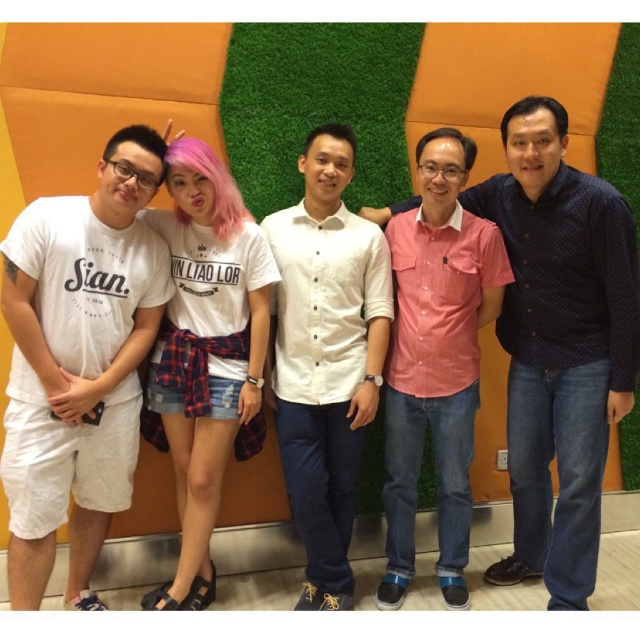
Is white cotton t-shirt at center above white cotton t-shirt at left?

No.

Who is more forward, (204,163) or (8,236)?

Positioned in front is point (8,236).

What are the coordinates of `white cotton t-shirt at center` in the screenshot? It's located at (205, 353).

Can you confirm if white cotton t-shirt at center is positioned to the right of black matte hair at center?

No, white cotton t-shirt at center is not to the right of black matte hair at center.

The image size is (640, 640). Find the location of `white cotton t-shirt at center`. white cotton t-shirt at center is located at coordinates (205, 353).

The width and height of the screenshot is (640, 640). Find the location of `white cotton t-shirt at center`. white cotton t-shirt at center is located at coordinates (205, 353).

Who is more forward, (516, 109) or (349, 132)?

Positioned in front is point (516, 109).

Which is more to the left, black matte hair at upper right or black matte hair at center?

black matte hair at center is more to the left.

Which is behind, point (532, 112) or point (346, 140)?

Positioned behind is point (346, 140).

The width and height of the screenshot is (640, 640). In order to click on black matte hair at upper right in this screenshot , I will do `click(534, 112)`.